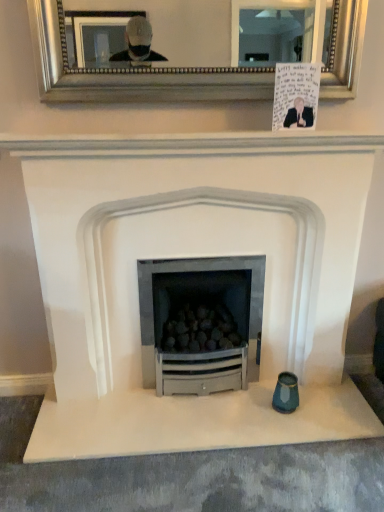
Image resolution: width=384 pixels, height=512 pixels. Describe the element at coordinates (296, 95) in the screenshot. I see `handwritten paper at upper center` at that location.

What is the approximate height of white matte fireplace at center?

It is 3.64 feet.

In the scene shown: What is the approximate width of white matte fireplace at center?

The width of white matte fireplace at center is 56.85 centimeters.

Locate an element on the screen. The width and height of the screenshot is (384, 512). silver/golden mirror at upper center is located at coordinates (132, 73).

Do you think handwritten paper at upper center is within silver/golden mirror at upper center, or outside of it?

handwritten paper at upper center is not inside silver/golden mirror at upper center, it's outside.

Consider the image. Considering the sizes of objects handwritten paper at upper center and silver/golden mirror at upper center in the image provided, who is taller, handwritten paper at upper center or silver/golden mirror at upper center?

With more height is silver/golden mirror at upper center.

Based on the photo, can you see handwritten paper at upper center touching silver/golden mirror at upper center?

No.

At what (x,y) coordinates should I click in order to perform the action: click on picture frame on the left of handwritten paper at upper center. Please return your answer as a coordinate pair (x, y). The width and height of the screenshot is (384, 512). Looking at the image, I should click on (132, 73).

Considering the sizes of white matte fireplace at center and silver/golden mirror at upper center in the image, is white matte fireplace at center wider or thinner than silver/golden mirror at upper center?

In the image, white matte fireplace at center appears to be wider than silver/golden mirror at upper center.

Is white matte fireplace at center situated inside silver/golden mirror at upper center or outside?

white matte fireplace at center lies outside silver/golden mirror at upper center.

Which of these two, white matte fireplace at center or silver/golden mirror at upper center, stands taller?

Standing taller between the two is white matte fireplace at center.

Between white matte fireplace at center and silver/golden mirror at upper center, which one appears on the right side from the viewer's perspective?

Positioned to the right is white matte fireplace at center.

Considering the positions of point (304, 64) and point (47, 229), is point (304, 64) closer or farther from the camera than point (47, 229)?

Clearly, point (304, 64) is closer to the camera than point (47, 229).

Considering the sizes of objects handwritten paper at upper center and white matte fireplace at center in the image provided, who is bigger, handwritten paper at upper center or white matte fireplace at center?

white matte fireplace at center is bigger.

Between handwritten paper at upper center and white matte fireplace at center, which one is positioned in front?

white matte fireplace at center is closer to the camera.

Is handwritten paper at upper center oriented towards white matte fireplace at center?

No, handwritten paper at upper center is not aimed at white matte fireplace at center.

Is white matte fireplace at center not within handwritten paper at upper center?

Yes.

Could you tell me if white matte fireplace at center is turned towards handwritten paper at upper center?

No, white matte fireplace at center is not turned towards handwritten paper at upper center.

Can you confirm if white matte fireplace at center is positioned to the left of handwritten paper at upper center?

Indeed, white matte fireplace at center is positioned on the left side of handwritten paper at upper center.

Which object is positioned more to the right, silver/golden mirror at upper center or white matte fireplace at center?

From the viewer's perspective, white matte fireplace at center appears more on the right side.

Considering the sizes of objects silver/golden mirror at upper center and white matte fireplace at center in the image provided, who is wider, silver/golden mirror at upper center or white matte fireplace at center?

white matte fireplace at center.

Which object is closer to the camera, silver/golden mirror at upper center or white matte fireplace at center?

Positioned in front is white matte fireplace at center.

Considering the sizes of silver/golden mirror at upper center and handwritten paper at upper center in the image, is silver/golden mirror at upper center wider or thinner than handwritten paper at upper center?

silver/golden mirror at upper center is wider than handwritten paper at upper center.

Based on their positions, is silver/golden mirror at upper center located to the left or right of handwritten paper at upper center?

From the image, it's evident that silver/golden mirror at upper center is to the left of handwritten paper at upper center.

How different are the orientations of silver/golden mirror at upper center and handwritten paper at upper center in degrees?

The angular difference between silver/golden mirror at upper center and handwritten paper at upper center is 4.96 degrees.

From a real-world perspective, which object stands above the other?

silver/golden mirror at upper center.

Where is `postcard that is behind the silver/golden mirror at upper center`? The width and height of the screenshot is (384, 512). postcard that is behind the silver/golden mirror at upper center is located at coordinates (296, 95).

Where is `picture frame located above the white matte fireplace at center (from the image's perspective)`? This screenshot has height=512, width=384. picture frame located above the white matte fireplace at center (from the image's perspective) is located at coordinates (132, 73).

Consider the image. Estimate the real-world distances between objects in this image. Which object is closer to white matte fireplace at center, silver/golden mirror at upper center or handwritten paper at upper center?

handwritten paper at upper center is closer to white matte fireplace at center.

Based on their spatial positions, is white matte fireplace at center or handwritten paper at upper center closer to silver/golden mirror at upper center?

Based on the image, handwritten paper at upper center appears to be nearer to silver/golden mirror at upper center.

Based on their spatial positions, is handwritten paper at upper center or white matte fireplace at center closer to silver/golden mirror at upper center?

The object closer to silver/golden mirror at upper center is handwritten paper at upper center.

From the image, which object appears to be farther from white matte fireplace at center, handwritten paper at upper center or silver/golden mirror at upper center?

Among the two, silver/golden mirror at upper center is located further to white matte fireplace at center.

Estimate the real-world distances between objects in this image. Which object is closer to handwritten paper at upper center, silver/golden mirror at upper center or white matte fireplace at center?

The object closer to handwritten paper at upper center is silver/golden mirror at upper center.

When comparing their distances from handwritten paper at upper center, does white matte fireplace at center or silver/golden mirror at upper center seem closer?

Based on the image, silver/golden mirror at upper center appears to be nearer to handwritten paper at upper center.

You are a GUI agent. You are given a task and a screenshot of the screen. Output one action in this format:
    pyautogui.click(x=<x>, y=<y>)
    Task: Click on the postcard that lies between silver/golden mirror at upper center and white matte fireplace at center from top to bottom
    Image resolution: width=384 pixels, height=512 pixels.
    Given the screenshot: What is the action you would take?
    tap(296, 95)